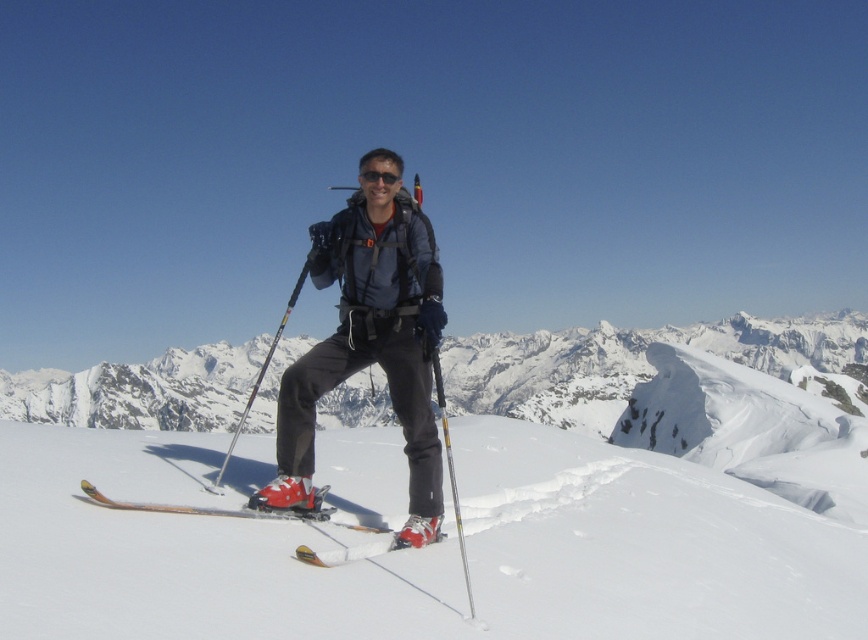
Question: Which point is closer to the camera?

Choices:
 (A) silver metallic ski pole at center
 (B) white snow ski slope at center

Answer: (B)

Question: Can you confirm if matte black ski suit at center is positioned to the right of wooden skis at lower center?

Choices:
 (A) yes
 (B) no

Answer: (A)

Question: Observing the image, what is the correct spatial positioning of snowy white mountain at center in reference to matte black ski pole at center?

Choices:
 (A) above
 (B) below

Answer: (B)

Question: Can you confirm if white snow ski slope at center is bigger than wooden skis at lower center?

Choices:
 (A) no
 (B) yes

Answer: (B)

Question: Which point is closer to the camera?

Choices:
 (A) transparent plastic goggles at center
 (B) white snow ski slope at center
 (C) matte black ski suit at center
 (D) silver metallic ski pole at center

Answer: (B)

Question: Which object appears closest to the camera in this image?

Choices:
 (A) white snow ski slope at center
 (B) matte black ski suit at center
 (C) silver metallic ski pole at center
 (D) snowy white mountain at center

Answer: (A)